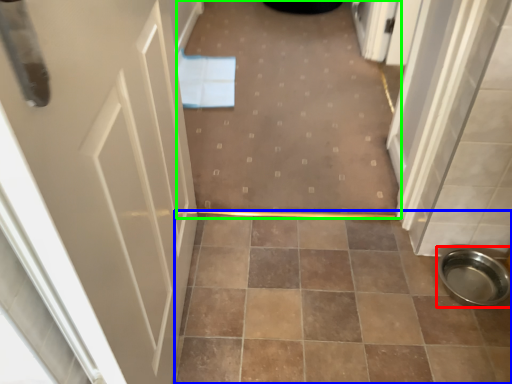
Question: Which object is positioned closest to toilet bowl (highlighted by a red box)? Select from ceramic tile (highlighted by a blue box) and plain (highlighted by a green box).

Choices:
 (A) ceramic tile
 (B) plain

Answer: (A)